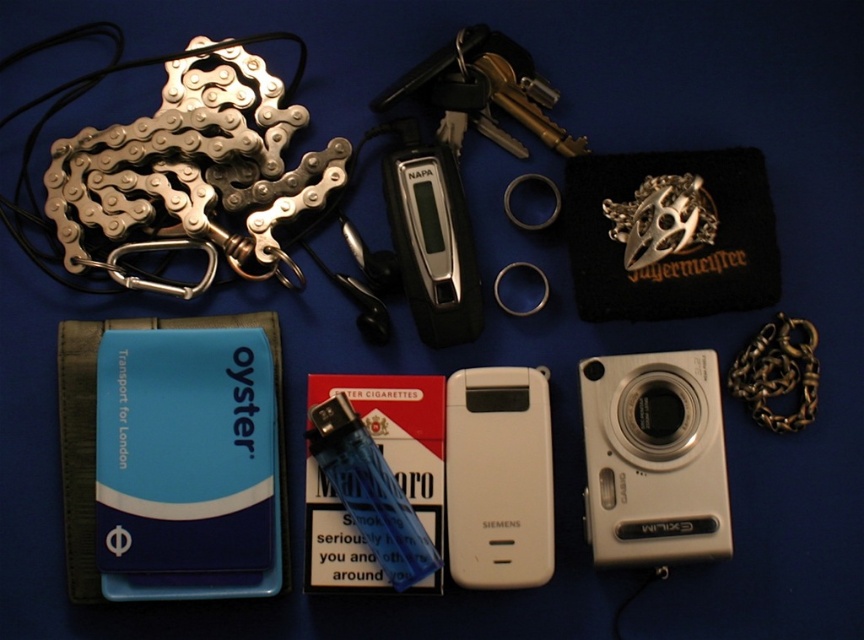
Question: Which point is closer to the camera?

Choices:
 (A) gold metallic chain at right
 (B) white plastic camera at lower right

Answer: (B)

Question: Is white plastic phone at center positioned in front of gold metallic chain at right?

Choices:
 (A) no
 (B) yes

Answer: (B)

Question: Considering the relative positions of white plastic camera at lower right and white plastic phone at center in the image provided, where is white plastic camera at lower right located with respect to white plastic phone at center?

Choices:
 (A) below
 (B) above

Answer: (B)

Question: Can you confirm if white plastic camera at lower right is positioned above gold metallic chain at right?

Choices:
 (A) no
 (B) yes

Answer: (A)

Question: Which point appears closest to the camera in this image?

Choices:
 (A) (591, 468)
 (B) (486, 515)

Answer: (A)

Question: Which of the following is the closest to the observer?

Choices:
 (A) (678, 426)
 (B) (792, 417)

Answer: (B)